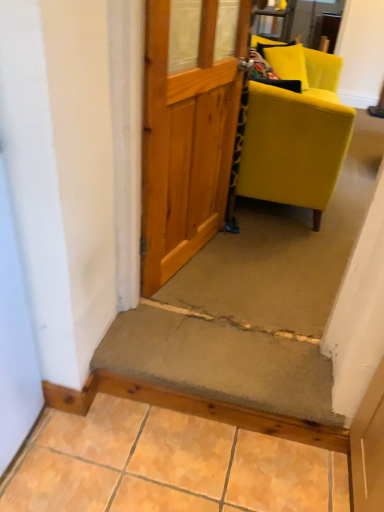
Describe the element at coordinates (254, 304) in the screenshot. I see `carpeted stairwell at center, acting as the first stairwell starting from the top` at that location.

Locate an element on the screen. Image resolution: width=384 pixels, height=512 pixels. smooth concrete step at lower center is located at coordinates pyautogui.click(x=167, y=466).

What do you see at coordinates (221, 360) in the screenshot? I see `concrete textured step at center, the second stairwell from the back` at bounding box center [221, 360].

Find the location of a particular element. carpeted stairwell at center, the second stairwell when ordered from bottom to top is located at coordinates (254, 304).

From the image's perspective, which object appears higher, matte yellow fabric chair at right or concrete textured step at center, the first stairwell positioned from the front?

matte yellow fabric chair at right.

From their relative heights in the image, would you say matte yellow fabric chair at right is taller or shorter than concrete textured step at center, the first stairwell positioned from the front?

Clearly, matte yellow fabric chair at right is taller compared to concrete textured step at center, the first stairwell positioned from the front.

Considering the positions of objects matte yellow fabric chair at right and concrete textured step at center, the second stairwell from the back, in the image provided, who is more to the right, matte yellow fabric chair at right or concrete textured step at center, the second stairwell from the back,?

Positioned to the right is matte yellow fabric chair at right.

Which is more to the left, matte yellow fabric chair at right or smooth concrete step at lower center?

From the viewer's perspective, smooth concrete step at lower center appears more on the left side.

From a real-world perspective, is matte yellow fabric chair at right over smooth concrete step at lower center?

Correct, in the physical world, matte yellow fabric chair at right is higher than smooth concrete step at lower center.

Which is in front, point (301, 128) or point (144, 443)?

The point (144, 443) is in front.

Considering the relative sizes of matte yellow fabric chair at right and smooth concrete step at lower center in the image provided, is matte yellow fabric chair at right bigger than smooth concrete step at lower center?

Yes.

From the image's perspective, starting from the matte yellow fabric chair at right, which stairwell is the 2nd one below? Please provide its 2D coordinates.

[(221, 360)]

Is concrete textured step at center, the first stairwell positioned from the front, spatially inside matte yellow fabric chair at right, or outside of it?

concrete textured step at center, the first stairwell positioned from the front, is spatially situated outside matte yellow fabric chair at right.

From the image's perspective, which is below, concrete textured step at center, placed as the 2th stairwell when sorted from top to bottom, or matte yellow fabric chair at right?

From the image's view, concrete textured step at center, placed as the 2th stairwell when sorted from top to bottom, is below.

Is point (305, 386) behind point (304, 96)?

No, (305, 386) is closer to viewer.

This screenshot has width=384, height=512. Identify the location of the 1st stairwell positioned above the smooth concrete step at lower center (from the image's perspective). (221, 360).

Who is shorter, concrete textured step at center, placed as the 2th stairwell when sorted from top to bottom, or smooth concrete step at lower center?

With less height is smooth concrete step at lower center.

Which is more to the right, concrete textured step at center, which is the first stairwell in bottom-to-top order, or smooth concrete step at lower center?

From the viewer's perspective, concrete textured step at center, which is the first stairwell in bottom-to-top order, appears more on the right side.

Is point (262, 409) closer or farther from the camera than point (149, 477)?

Point (262, 409) is positioned farther from the camera compared to point (149, 477).

From the image's perspective, between matte yellow fabric chair at right and carpeted stairwell at center, positioned as the second stairwell in front-to-back order, which one is located above?

matte yellow fabric chair at right, from the image's perspective.

Considering the sizes of matte yellow fabric chair at right and carpeted stairwell at center, positioned as the second stairwell in front-to-back order, in the image, is matte yellow fabric chair at right taller or shorter than carpeted stairwell at center, positioned as the second stairwell in front-to-back order,?

Clearly, matte yellow fabric chair at right is taller compared to carpeted stairwell at center, positioned as the second stairwell in front-to-back order.

Which is more to the left, matte yellow fabric chair at right or carpeted stairwell at center, the second stairwell when ordered from bottom to top?

From the viewer's perspective, matte yellow fabric chair at right appears more on the left side.

What's the angular difference between matte yellow fabric chair at right and carpeted stairwell at center, acting as the first stairwell starting from the top,'s facing directions?

The angular difference between matte yellow fabric chair at right and carpeted stairwell at center, acting as the first stairwell starting from the top, is 92 degrees.

The image size is (384, 512). I want to click on the 2nd stairwell above the smooth concrete step at lower center (from a real-world perspective), so click(x=254, y=304).

Looking at this image, from a real-world perspective, is smooth concrete step at lower center above or below carpeted stairwell at center, the second stairwell when ordered from bottom to top?

In terms of real-world spatial position, smooth concrete step at lower center is below carpeted stairwell at center, the second stairwell when ordered from bottom to top.

Considering the relative sizes of smooth concrete step at lower center and carpeted stairwell at center, acting as the first stairwell starting from the top, in the image provided, is smooth concrete step at lower center shorter than carpeted stairwell at center, acting as the first stairwell starting from the top,?

Indeed, smooth concrete step at lower center has a lesser height compared to carpeted stairwell at center, acting as the first stairwell starting from the top.

Is carpeted stairwell at center, marked as the first stairwell in a back-to-front arrangement, positioned with its back to matte yellow fabric chair at right?

That's not correct — carpeted stairwell at center, marked as the first stairwell in a back-to-front arrangement, is not looking away from matte yellow fabric chair at right.

Which object is positioned more to the left, carpeted stairwell at center, acting as the first stairwell starting from the top, or matte yellow fabric chair at right?

matte yellow fabric chair at right.

From the image's perspective, which one is positioned higher, carpeted stairwell at center, marked as the first stairwell in a back-to-front arrangement, or matte yellow fabric chair at right?

From the image's view, matte yellow fabric chair at right is above.

Are carpeted stairwell at center, marked as the first stairwell in a back-to-front arrangement, and matte yellow fabric chair at right far apart?

No, carpeted stairwell at center, marked as the first stairwell in a back-to-front arrangement, is not far away from matte yellow fabric chair at right.

Where is `stairwell on the left of the matte yellow fabric chair at right`? This screenshot has height=512, width=384. stairwell on the left of the matte yellow fabric chair at right is located at coordinates click(221, 360).

Find the location of a particular element. The image size is (384, 512). concrete located in front of the matte yellow fabric chair at right is located at coordinates (167, 466).

Which object lies further to the anchor point carpeted stairwell at center, acting as the first stairwell starting from the top, smooth concrete step at lower center or matte yellow fabric chair at right?

The object further to carpeted stairwell at center, acting as the first stairwell starting from the top, is matte yellow fabric chair at right.

In the scene shown: Which object lies nearer to the anchor point smooth concrete step at lower center, matte yellow fabric chair at right or carpeted stairwell at center, marked as the first stairwell in a back-to-front arrangement?

carpeted stairwell at center, marked as the first stairwell in a back-to-front arrangement, is positioned closer to the anchor smooth concrete step at lower center.

Considering their positions, is carpeted stairwell at center, the second stairwell when ordered from bottom to top, positioned further to smooth concrete step at lower center than matte yellow fabric chair at right?

Based on the image, matte yellow fabric chair at right appears to be further to smooth concrete step at lower center.

From the image, which object appears to be nearer to smooth concrete step at lower center, matte yellow fabric chair at right or concrete textured step at center, the second stairwell from the back?

concrete textured step at center, the second stairwell from the back.

Considering their positions, is matte yellow fabric chair at right positioned further to carpeted stairwell at center, acting as the first stairwell starting from the top, than smooth concrete step at lower center?

matte yellow fabric chair at right lies further to carpeted stairwell at center, acting as the first stairwell starting from the top, than the other object.

From the image, which object appears to be farther from matte yellow fabric chair at right, carpeted stairwell at center, marked as the first stairwell in a back-to-front arrangement, or smooth concrete step at lower center?

smooth concrete step at lower center is positioned further to the anchor matte yellow fabric chair at right.

Considering their positions, is matte yellow fabric chair at right positioned further to concrete textured step at center, the second stairwell from the back, than carpeted stairwell at center, the second stairwell when ordered from bottom to top?

matte yellow fabric chair at right is positioned further to the anchor concrete textured step at center, the second stairwell from the back.

Estimate the real-world distances between objects in this image. Which object is further from matte yellow fabric chair at right, smooth concrete step at lower center or carpeted stairwell at center, the second stairwell when ordered from bottom to top?

smooth concrete step at lower center lies further to matte yellow fabric chair at right than the other object.

Image resolution: width=384 pixels, height=512 pixels. Find the location of `stairwell that lies between matte yellow fabric chair at right and concrete textured step at center, which is the first stairwell in bottom-to-top order, from top to bottom`. stairwell that lies between matte yellow fabric chair at right and concrete textured step at center, which is the first stairwell in bottom-to-top order, from top to bottom is located at coordinates (254, 304).

Find the location of `stairwell between carpeted stairwell at center, the second stairwell when ordered from bottom to top, and smooth concrete step at lower center from top to bottom`. stairwell between carpeted stairwell at center, the second stairwell when ordered from bottom to top, and smooth concrete step at lower center from top to bottom is located at coordinates (221, 360).